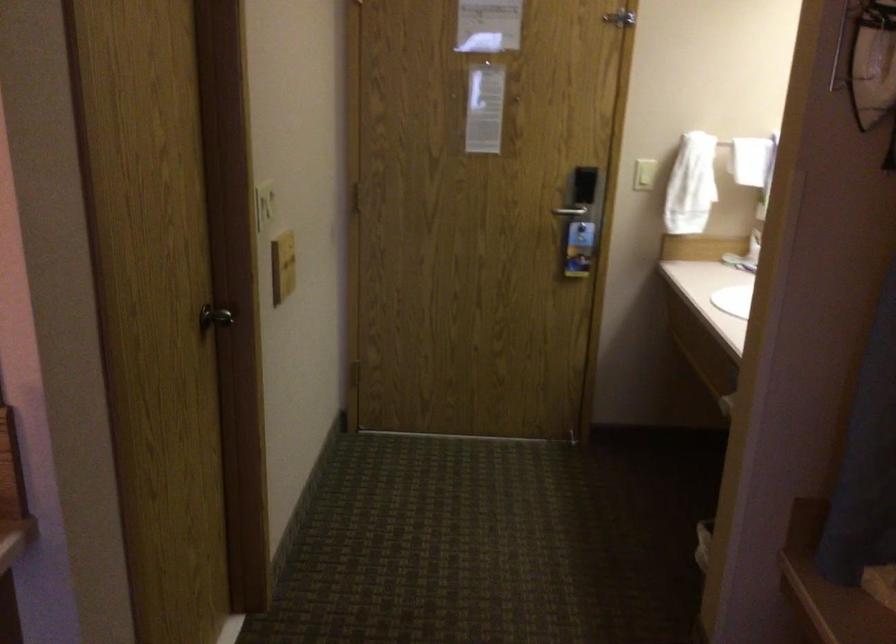
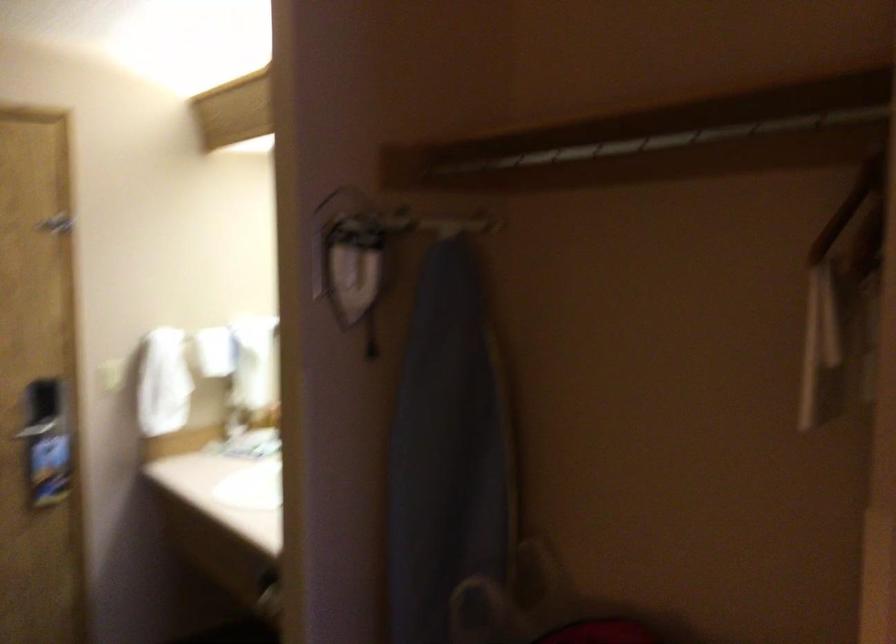
Question: How did the camera likely rotate?

Choices:
 (A) Left
 (B) Right
 (C) Up
 (D) Down

Answer: (B)